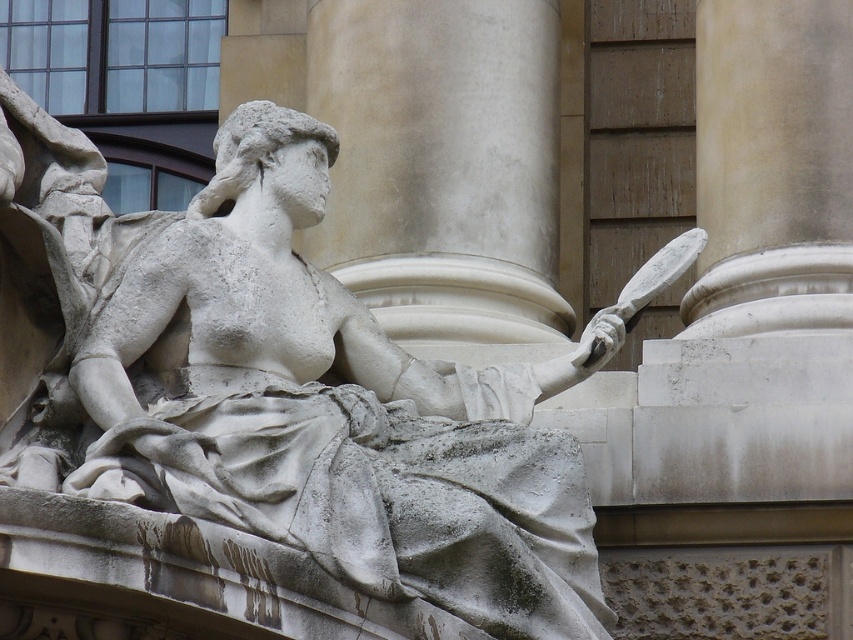
You are an art student analyzing the sculpture and its surroundings. Based on the scene, which object is bigger between the white stone statue at center and the white marble column at center?

The white stone statue at center is larger in size than the white marble column at center.

You are a maintenance worker tasked with cleaning the white stone statue at center and the white marble column at center. You have a ladder that can reach up to 14 meters. Can you safely reach both objects with your ladder without needing to move it?

The white stone statue at center and the white marble column at center are 14.78 meters apart from each other. Since the ladder can only reach up to 14 meters, you cannot safely reach both objects without moving the ladder because the distance between them exceeds the ladder length.